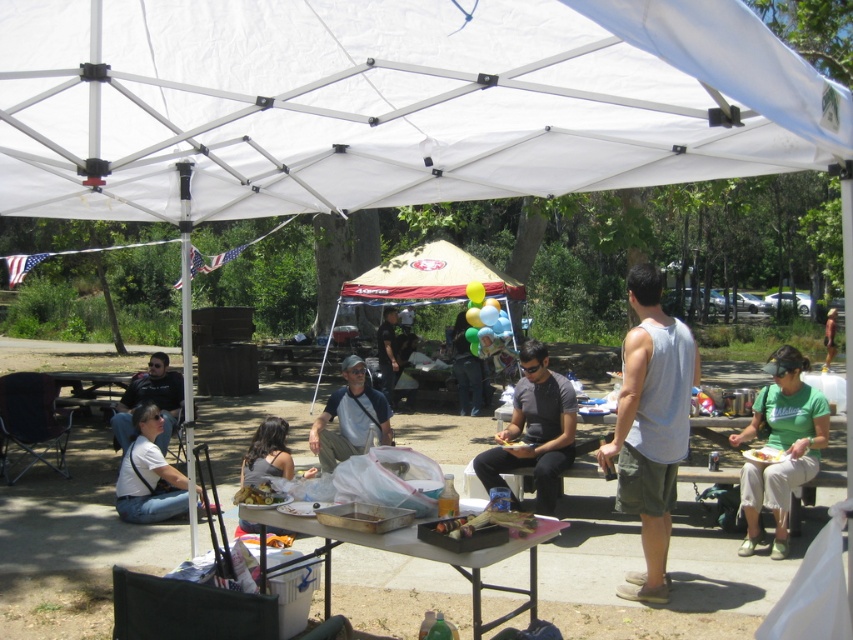
Does point (113, 40) come closer to viewer compared to point (405, 269)?

Yes.

Does point (592, 186) come behind point (450, 289)?

No.

At what (x,y) coordinates should I click in order to perform the action: click on white fabric canopy at upper center. Please return your answer as a coordinate pair (x, y). The image size is (853, 640). Looking at the image, I should click on click(392, 102).

Can you confirm if white fabric canopy at upper center is positioned below dark gray shirt at center?

Incorrect, white fabric canopy at upper center is not positioned below dark gray shirt at center.

Who is lower down, white fabric canopy at upper center or dark gray shirt at center?

dark gray shirt at center is below.

Who is more distant from viewer, (827, 83) or (541, 451)?

The point (541, 451) is more distant.

Find the location of `white fabric canopy at upper center`. white fabric canopy at upper center is located at coordinates 392,102.

Who is positioned more to the left, matte black purse at lower center or dark blue jeans at center?

From the viewer's perspective, matte black purse at lower center appears more on the left side.

Which of these two, matte black purse at lower center or dark blue jeans at center, stands taller?

dark blue jeans at center is taller.

Describe the element at coordinates (267, 452) in the screenshot. I see `matte black purse at lower center` at that location.

You are a GUI agent. You are given a task and a screenshot of the screen. Output one action in this format:
    pyautogui.click(x=<x>, y=<y>)
    Task: Click on the matte black purse at lower center
    Image resolution: width=853 pixels, height=640 pixels.
    Given the screenshot: What is the action you would take?
    pyautogui.click(x=267, y=452)